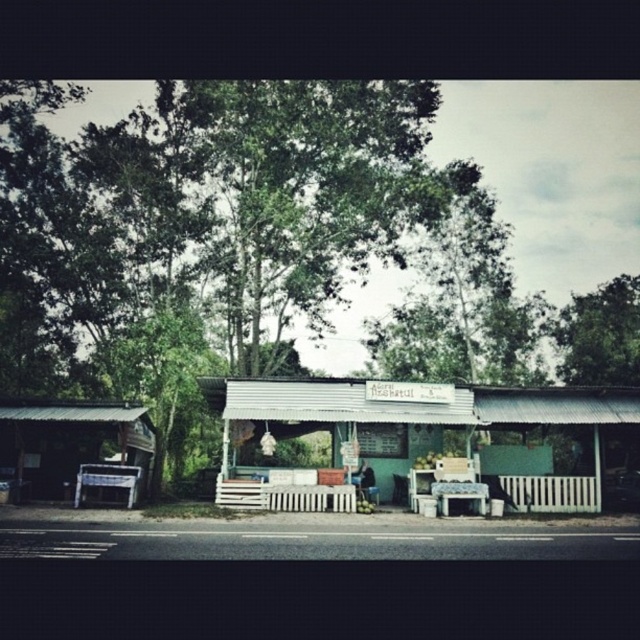
In the scene shown: You are setting up a small event and need to seat guests. You have two tables available at the stall area. Which table, the white plastic picnic table at left or the white plastic table at center, can accommodate more people if they are placed side by side?

The white plastic picnic table at left might be wider than white plastic table at center, so it can accommodate more people when placed side by side.

Looking at this image, based on the coordinates provided, where is the green leafy tree at upper right located in the image?

The green leafy tree at upper right is located at the coordinates point [600,333] in the image.

You are setting up a picnic and need to choose between the white plastic picnic table at left and the white plastic table at center. Which one should you choose if you want a bigger table for more space?

You should choose the white plastic picnic table at left because it is larger in size than the white plastic table at center, providing more space for your picnic setup.